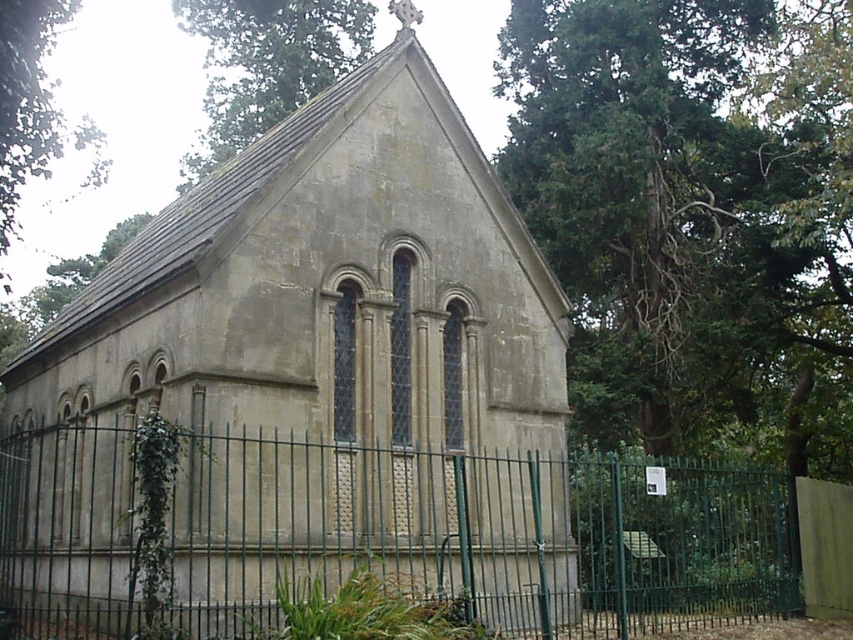
You are standing in front of the chapel and notice two points marked on the chapel wall. The first point is at coordinates point (x=257, y=1) and the second is at point (x=90, y=122). From your perspective, which point is closer to you?

Point (x=257, y=1) is in front of point (x=90, y=122), so it is closer to you.

You are standing at the entrance of the chapel and want to locate the matte stone church at center. What are the coordinates where you should look?

The matte stone church at center is located at coordinates point (314, 371).